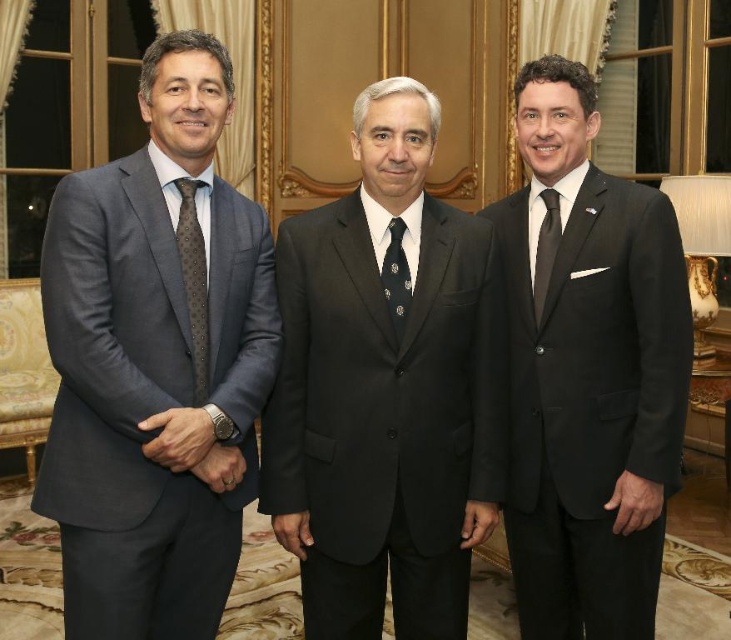
Question: Can you confirm if matte black suit at right is positioned to the left of black silk tie at right?

Choices:
 (A) no
 (B) yes

Answer: (A)

Question: Which object is the farthest from the matte black suit at right?

Choices:
 (A) black silk tie at center
 (B) matte gray suit at left

Answer: (B)

Question: Which of the following is the farthest from the observer?

Choices:
 (A) black satin suit at center
 (B) matte gray suit at left

Answer: (A)

Question: Which point is closer to the camera?

Choices:
 (A) dark gray dotted tie at left
 (B) black silk tie at right
 (C) matte gray suit at left
 (D) black silk tie at center

Answer: (C)

Question: Where is matte black suit at right located in relation to black silk tie at right in the image?

Choices:
 (A) left
 (B) right

Answer: (B)

Question: Is black silk tie at center below black silk tie at right?

Choices:
 (A) no
 (B) yes

Answer: (B)